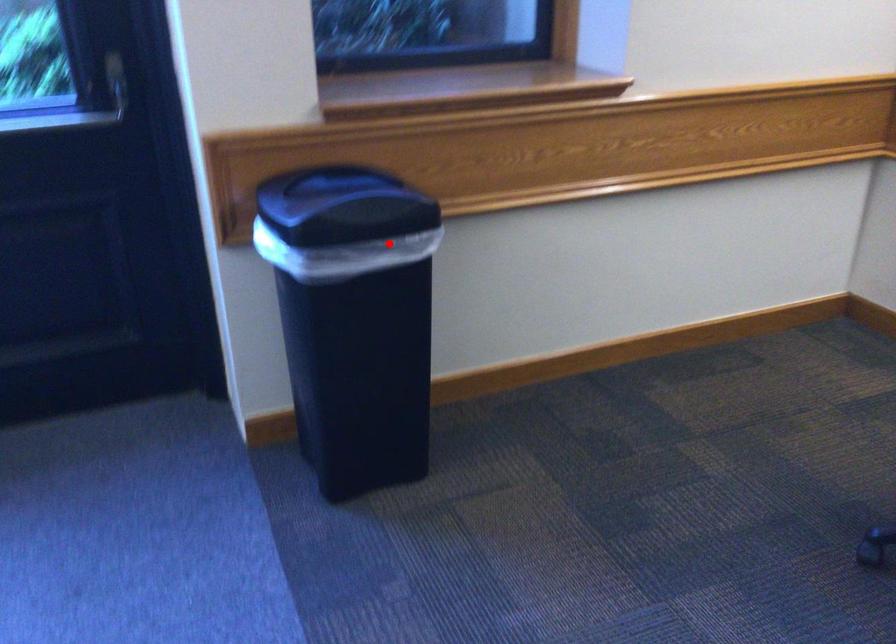
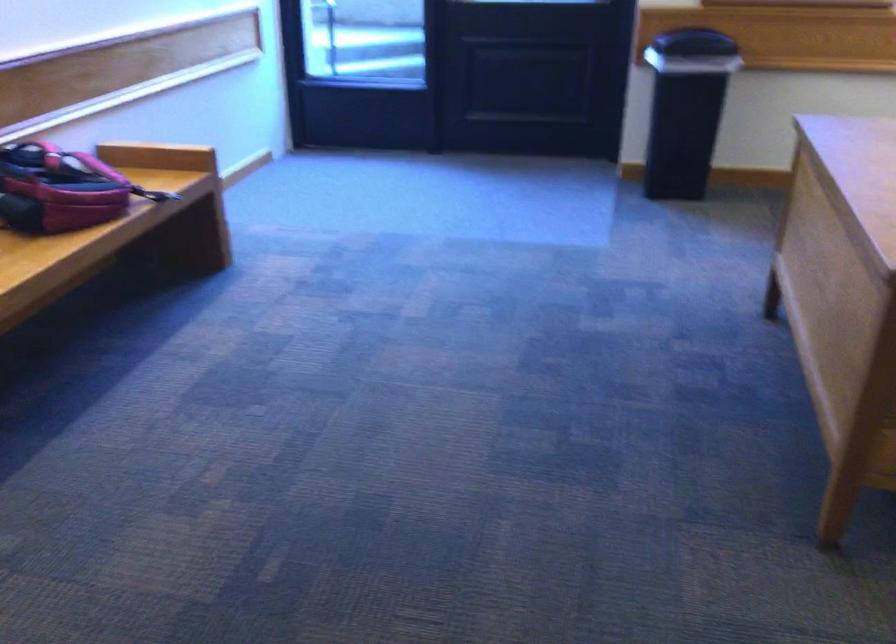
Where in the second image is the point corresponding to the highlighted location from the first image?

(694, 43)